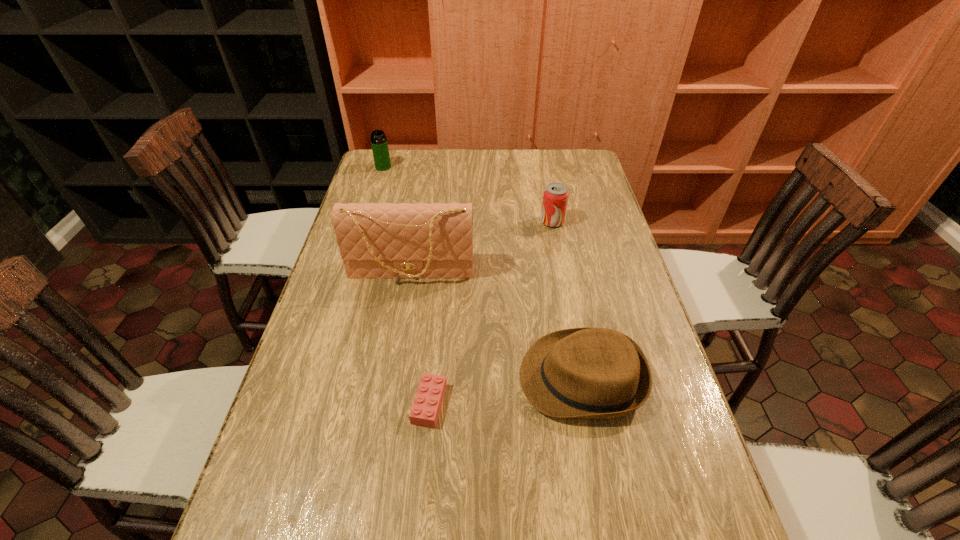
Where is `vacant point located between the Lego and the second tallest object`? This screenshot has height=540, width=960. vacant point located between the Lego and the second tallest object is located at coordinates (406, 285).

The image size is (960, 540). In order to click on free spot between the tallest object and the fedora in this screenshot , I will do `click(496, 325)`.

Where is `free space between the third tallest object and the fedora`? This screenshot has width=960, height=540. free space between the third tallest object and the fedora is located at coordinates (567, 300).

Where is `object that is the second closest to the fedora`? Image resolution: width=960 pixels, height=540 pixels. object that is the second closest to the fedora is located at coordinates (376, 241).

Locate which object ranks in proximity to the soda can. Please provide its 2D coordinates. Your answer should be formatted as a tuple, i.e. [(x, y)], where the tuple contains the x and y coordinates of a point satisfying the conditions above.

[(376, 241)]

The height and width of the screenshot is (540, 960). Identify the location of free space that satisfies the following two spatial constraints: 1. on the front side of the second farthest object; 2. on the front-facing side of the second shortest object. (583, 379).

Locate an element on the screen. vacant space that satisfies the following two spatial constraints: 1. from the spout of the thermos bottle; 2. on the left side of the shortest object is located at coordinates (311, 403).

Find the location of a particular element. The image size is (960, 540). free space that satisfies the following two spatial constraints: 1. on the back side of the third tallest object; 2. on the right side of the Lego is located at coordinates click(x=446, y=221).

Where is `vacant region that satisfies the following two spatial constraints: 1. on the front side of the soda can; 2. on the front-facing side of the fedora`? vacant region that satisfies the following two spatial constraints: 1. on the front side of the soda can; 2. on the front-facing side of the fedora is located at coordinates (583, 379).